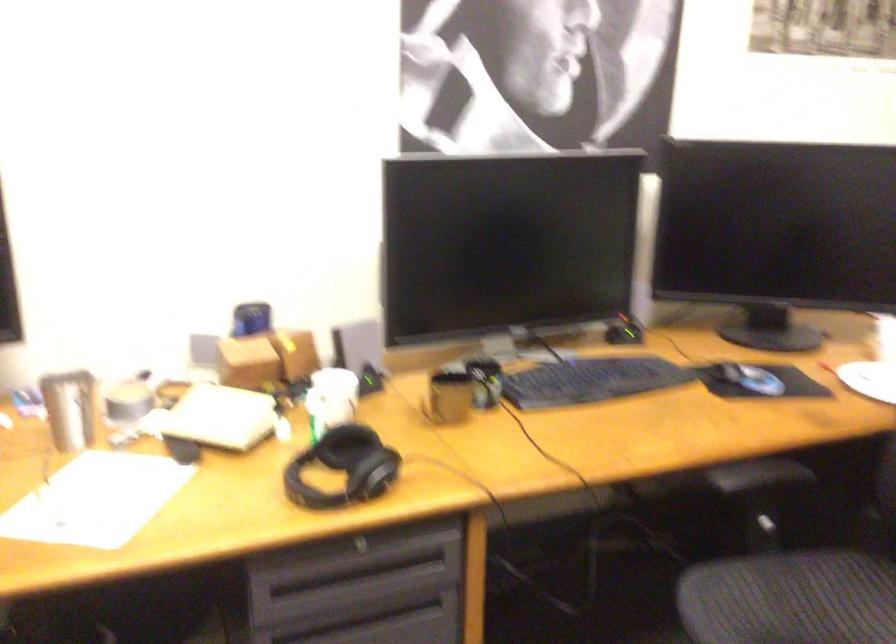
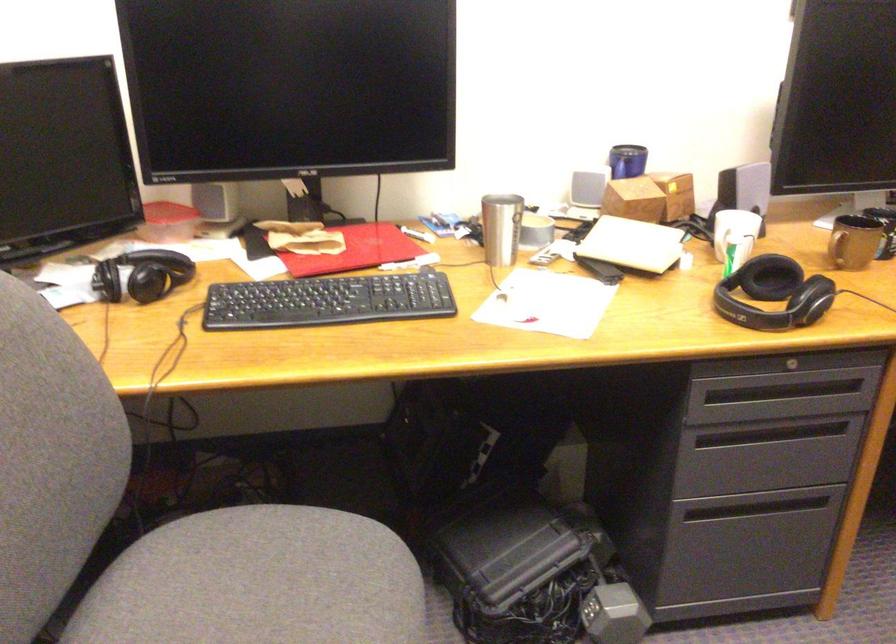
The point at (243, 370) is marked in the first image. Where is the corresponding point in the second image?

(633, 200)